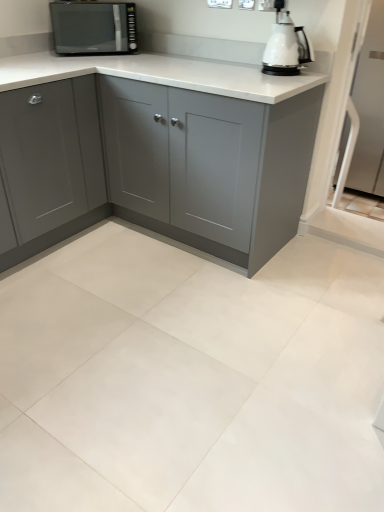
Question: Considering the relative positions of matte gray cabinet at center, the second cabinetry in the left-to-right sequence, and white glossy kettle at upper right in the image provided, is matte gray cabinet at center, the second cabinetry in the left-to-right sequence, to the left of white glossy kettle at upper right from the viewer's perspective?

Choices:
 (A) no
 (B) yes

Answer: (B)

Question: Does matte gray cabinet at center, which is the first cabinetry in right-to-left order, have a lesser height compared to white glossy kettle at upper right?

Choices:
 (A) no
 (B) yes

Answer: (A)

Question: Considering the relative positions of matte gray cabinet at center, which is the first cabinetry in right-to-left order, and white glossy kettle at upper right in the image provided, is matte gray cabinet at center, which is the first cabinetry in right-to-left order, behind white glossy kettle at upper right?

Choices:
 (A) yes
 (B) no

Answer: (B)

Question: Considering the relative sizes of matte gray cabinet at center, the second cabinetry in the left-to-right sequence, and white glossy kettle at upper right in the image provided, is matte gray cabinet at center, the second cabinetry in the left-to-right sequence, bigger than white glossy kettle at upper right?

Choices:
 (A) no
 (B) yes

Answer: (B)

Question: From the image's perspective, is matte gray cabinet at center, which is the first cabinetry in right-to-left order, on top of white glossy kettle at upper right?

Choices:
 (A) yes
 (B) no

Answer: (B)

Question: Does matte gray cabinet at center, which is the first cabinetry in right-to-left order, turn towards white glossy kettle at upper right?

Choices:
 (A) no
 (B) yes

Answer: (A)

Question: Is white glossy kettle at upper right with satin black microwave at upper left?

Choices:
 (A) no
 (B) yes

Answer: (A)

Question: Can you confirm if white glossy kettle at upper right is taller than satin black microwave at upper left?

Choices:
 (A) no
 (B) yes

Answer: (A)

Question: From the image's perspective, does white glossy kettle at upper right appear lower than satin black microwave at upper left?

Choices:
 (A) yes
 (B) no

Answer: (A)

Question: Can you confirm if white glossy kettle at upper right is wider than satin black microwave at upper left?

Choices:
 (A) yes
 (B) no

Answer: (B)

Question: Can you confirm if white glossy kettle at upper right is smaller than satin black microwave at upper left?

Choices:
 (A) yes
 (B) no

Answer: (A)

Question: Can you confirm if white glossy kettle at upper right is bigger than satin black microwave at upper left?

Choices:
 (A) no
 (B) yes

Answer: (A)

Question: Considering the relative sizes of satin black microwave at upper left and matte gray cabinet at left, the second cabinetry from the right, in the image provided, is satin black microwave at upper left smaller than matte gray cabinet at left, the second cabinetry from the right,?

Choices:
 (A) no
 (B) yes

Answer: (B)